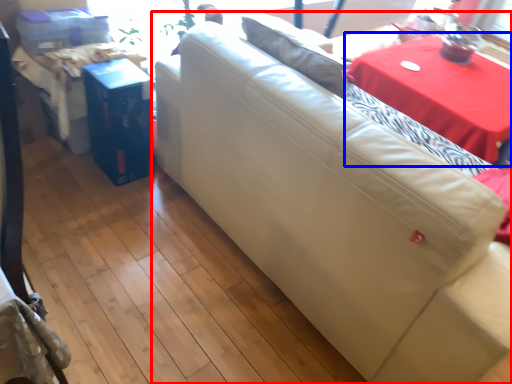
Question: Which object appears closest to the camera in this image, studio couch (highlighted by a red box) or table (highlighted by a blue box)?

Choices:
 (A) studio couch
 (B) table

Answer: (A)